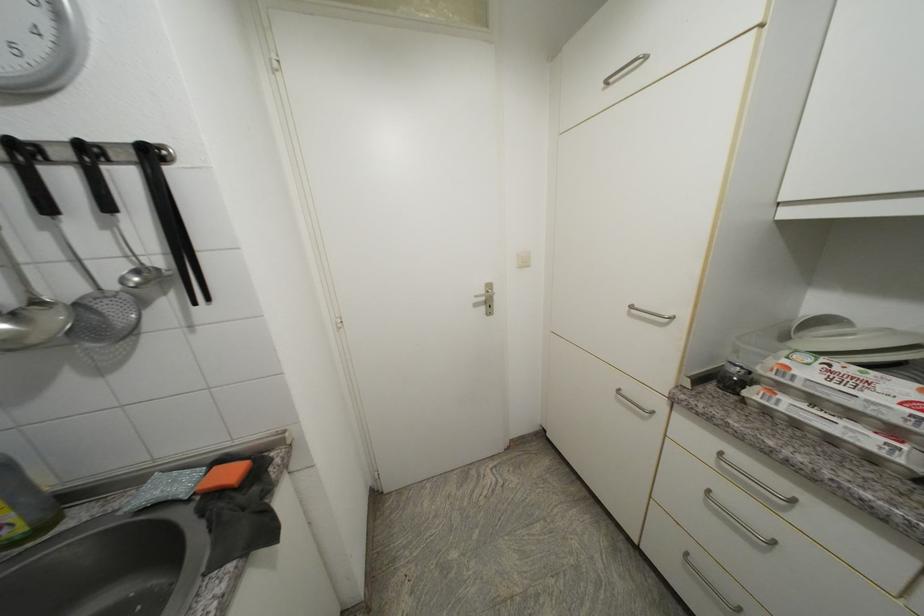
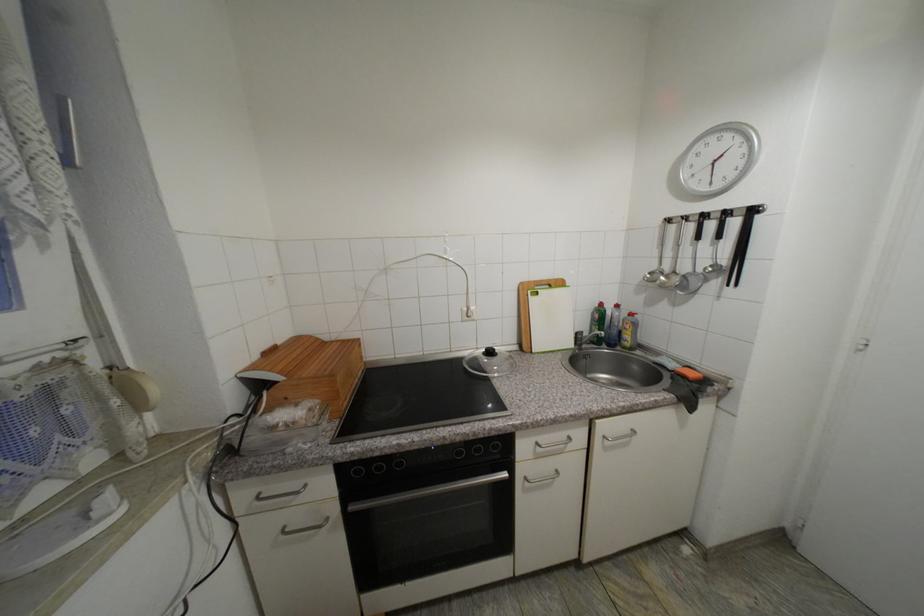
The images are taken continuously from a first-person perspective. In which direction is your viewpoint rotating?

The camera rotated toward left-down.